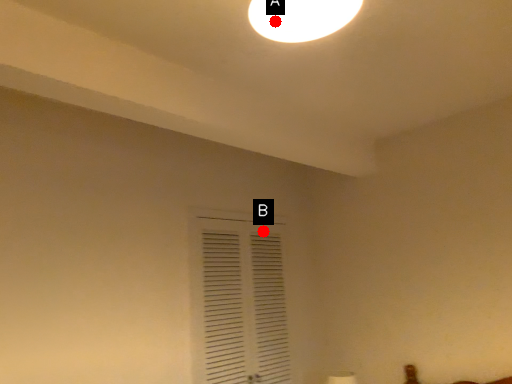
Question: Two points are circled on the image, labeled by A and B beside each circle. Which point appears closest to the camera in this image?

Choices:
 (A) A is closer
 (B) B is closer

Answer: (A)